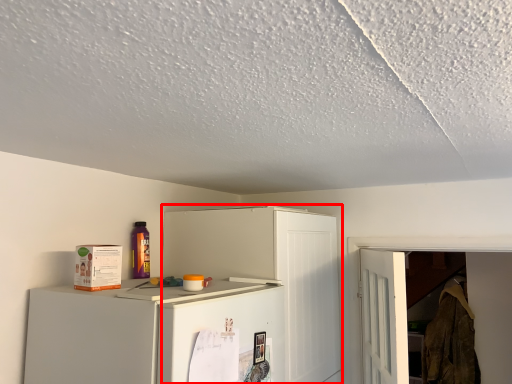
Question: Where is cabinetry (annotated by the red box) located in relation to laundry in the image?

Choices:
 (A) right
 (B) left

Answer: (B)